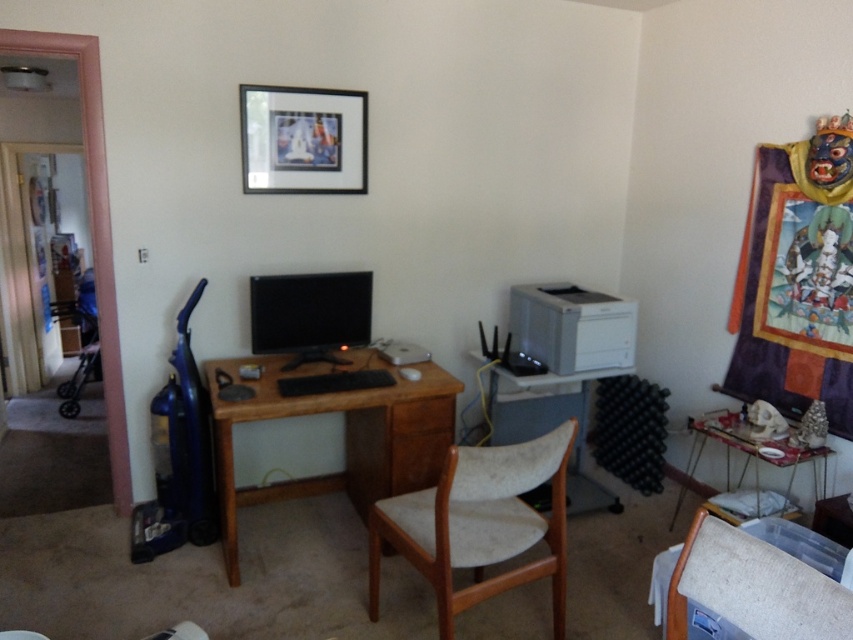
Question: Is black glossy monitor at center above metallic silver table at lower right?

Choices:
 (A) no
 (B) yes

Answer: (B)

Question: Which of the following is the closest to the observer?

Choices:
 (A) (315, 170)
 (B) (671, 596)
 (C) (229, 428)
 (D) (689, 422)

Answer: (B)

Question: Does metallic silver table at lower right appear under beige fabric swivel chair at lower right?

Choices:
 (A) no
 (B) yes

Answer: (B)

Question: Observing the image, what is the correct spatial positioning of black matte picture frame at upper center in reference to black glossy monitor at center?

Choices:
 (A) below
 (B) above

Answer: (B)

Question: Which point is farther to the camera?

Choices:
 (A) (224, 449)
 (B) (498, 374)
 (C) (724, 436)

Answer: (B)

Question: Estimate the real-world distances between objects in this image. Which object is closer to the brown wood computer desk at center?

Choices:
 (A) black matte picture frame at upper center
 (B) beige fabric swivel chair at lower right

Answer: (A)